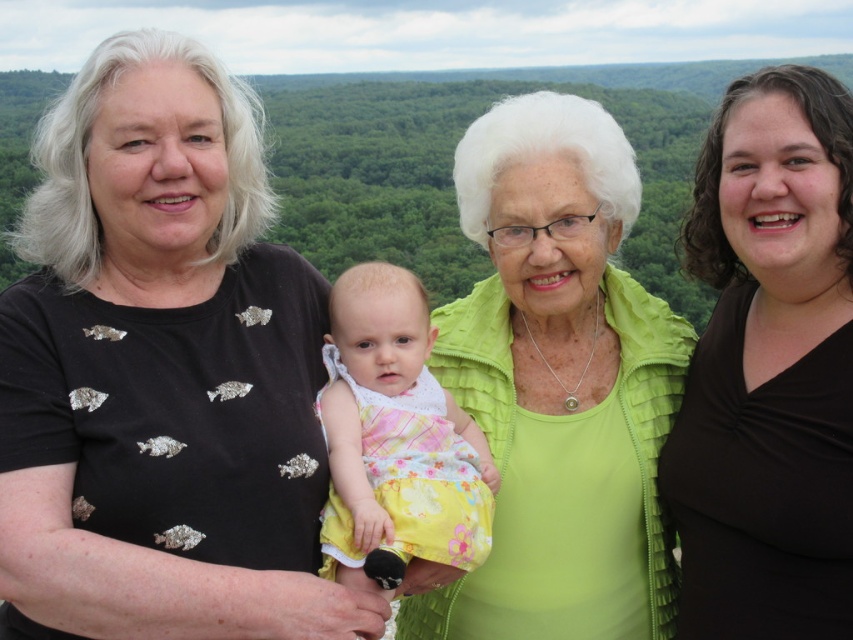
Is black textured shirt at left positioned before yellow floral dress at center?

Yes, black textured shirt at left is in front of yellow floral dress at center.

Which of these two, black textured shirt at left or yellow floral dress at center, stands taller?

black textured shirt at left

Identify the location of black textured shirt at left. This screenshot has width=853, height=640. (160, 371).

Is point (88, 572) farther from viewer compared to point (492, 333)?

No, it is not.

Who is lower down, black textured shirt at left or lime green textured jacket at center?

lime green textured jacket at center is below.

Identify the location of black textured shirt at left. (160, 371).

I want to click on black textured shirt at left, so click(x=160, y=371).

Between black textured shirt at left and green textured jacket at upper center, which one has less height?

With less height is green textured jacket at upper center.

Can you confirm if black textured shirt at left is smaller than green textured jacket at upper center?

No.

Does point (148, 593) lie in front of point (724, 138)?

Yes, point (148, 593) is closer to viewer.

Find the location of a particular element. The height and width of the screenshot is (640, 853). black textured shirt at left is located at coordinates (160, 371).